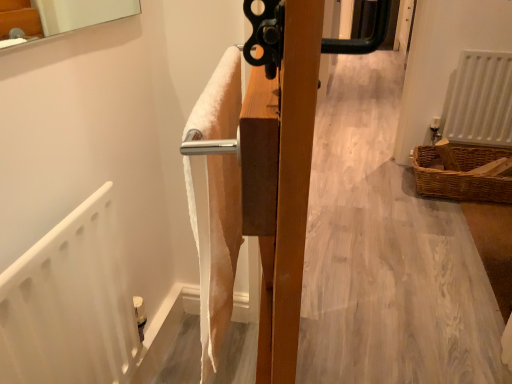
What do you see at coordinates (461, 176) in the screenshot? I see `brown woven basket at lower right` at bounding box center [461, 176].

What is the approximate height of brown woven basket at lower right?

The height of brown woven basket at lower right is 7.62 inches.

What are the coordinates of `brown woven basket at lower right` in the screenshot? It's located at (461, 176).

What do you see at coordinates (479, 100) in the screenshot?
I see `white matte radiator at right` at bounding box center [479, 100].

In order to click on white matte radiator at right in this screenshot , I will do pos(479,100).

The image size is (512, 384). What are the coordinates of `brown woven basket at lower right` in the screenshot? It's located at (461, 176).

Which is more to the right, brown woven basket at lower right or white matte radiator at right?

white matte radiator at right is more to the right.

Is brown woven basket at lower right positioned before white matte radiator at right?

Yes, it is.

Is point (468, 187) closer or farther from the camera than point (500, 125)?

Point (468, 187) appears to be closer to the viewer than point (500, 125).

From the image's perspective, is brown woven basket at lower right above or below white matte radiator at right?

Clearly, from the image's perspective, brown woven basket at lower right is below white matte radiator at right.

Looking at this image, from a real-world perspective, which object stands above the other?

white matte radiator at right is physically above.

Which of these two, brown woven basket at lower right or white matte radiator at right, is thinner?

white matte radiator at right is thinner.

Considering the sizes of objects brown woven basket at lower right and white matte radiator at right in the image provided, who is taller, brown woven basket at lower right or white matte radiator at right?

white matte radiator at right is taller.

Is brown woven basket at lower right smaller than white matte radiator at right?

No.

Is white matte radiator at right inside brown woven basket at lower right?

Actually, white matte radiator at right is outside brown woven basket at lower right.

Is brown woven basket at lower right with white matte radiator at right?

No, brown woven basket at lower right is not in contact with white matte radiator at right.

Is brown woven basket at lower right oriented away from white matte radiator at right?

brown woven basket at lower right is not turned away from white matte radiator at right.

You are a GUI agent. You are given a task and a screenshot of the screen. Output one action in this format:
    pyautogui.click(x=<x>, y=<y>)
    Task: Click on the basket in front of the white matte radiator at right
    This screenshot has width=512, height=384.
    Given the screenshot: What is the action you would take?
    pyautogui.click(x=461, y=176)

Can you confirm if white matte radiator at right is positioned to the right of brown woven basket at lower right?

Yes, white matte radiator at right is to the right of brown woven basket at lower right.

Is white matte radiator at right in front of or behind brown woven basket at lower right in the image?

Clearly, white matte radiator at right is behind brown woven basket at lower right.

Does point (507, 102) come behind point (495, 191)?

Yes, it is.

From the image's perspective, is white matte radiator at right located above or below brown woven basket at lower right?

white matte radiator at right is above brown woven basket at lower right.

From a real-world perspective, is white matte radiator at right positioned above or below brown woven basket at lower right?

white matte radiator at right is situated higher than brown woven basket at lower right in the real world.

Considering the relative sizes of white matte radiator at right and brown woven basket at lower right in the image provided, is white matte radiator at right thinner than brown woven basket at lower right?

Yes, white matte radiator at right is thinner than brown woven basket at lower right.

Between white matte radiator at right and brown woven basket at lower right, which one has less height?

Standing shorter between the two is brown woven basket at lower right.

Can you confirm if white matte radiator at right is bigger than brown woven basket at lower right?

Incorrect, white matte radiator at right is not larger than brown woven basket at lower right.

Is white matte radiator at right located outside brown woven basket at lower right?

Yes, white matte radiator at right is not within brown woven basket at lower right.

In the scene shown: Is white matte radiator at right far from brown woven basket at lower right?

They are positioned close to each other.

Could you tell me if white matte radiator at right is facing brown woven basket at lower right?

No.

Image resolution: width=512 pixels, height=384 pixels. I want to click on radiator on the right of brown woven basket at lower right, so click(x=479, y=100).

This screenshot has width=512, height=384. Identify the location of radiator that is above the brown woven basket at lower right (from the image's perspective). (479, 100).

Where is `radiator behind the brown woven basket at lower right`? The width and height of the screenshot is (512, 384). radiator behind the brown woven basket at lower right is located at coordinates (479, 100).